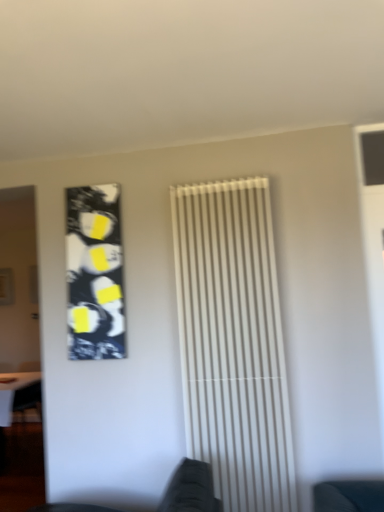
Question: In terms of size, does black and white abstract art at upper left appear bigger or smaller than white glossy table at lower left?

Choices:
 (A) small
 (B) big

Answer: (A)

Question: Relative to white glossy table at lower left, is black and white abstract art at upper left in front or behind?

Choices:
 (A) behind
 (B) front

Answer: (B)

Question: Which object is the closest to the white glossy table at lower left?

Choices:
 (A) white matte radiator at center
 (B) black and white abstract art at upper left

Answer: (B)

Question: Which object is positioned farthest from the white glossy table at lower left?

Choices:
 (A) black and white abstract art at upper left
 (B) white matte radiator at center

Answer: (B)